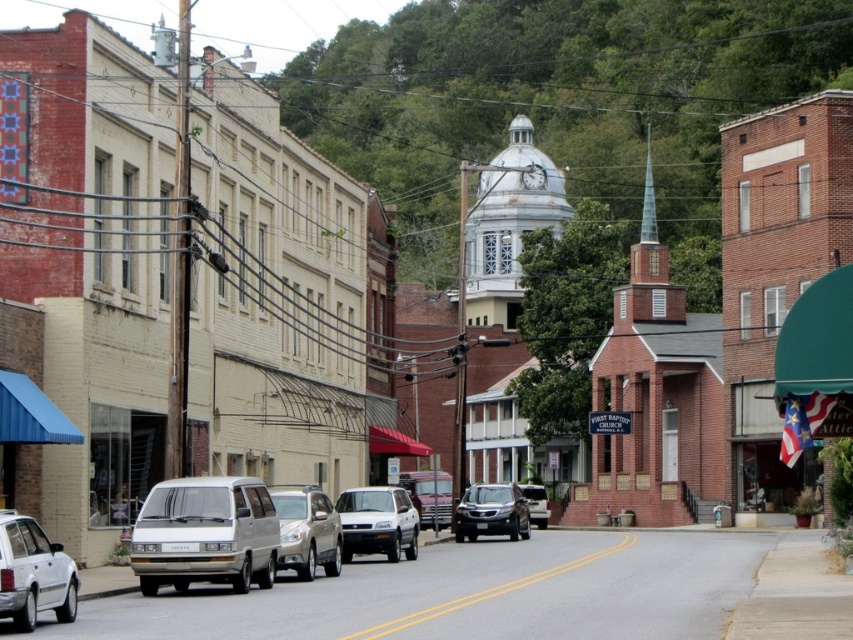
You are standing at the point with coordinates (206, 534) on the street. What object is exactly at your current location?

The white matte van at center is located at point (206, 534), so the object exactly at your current location is the white matte van at center.

You are a delivery driver who needs to park your truck between the white matte van at center and the white matte suv at center on the street. The parking space between them is exactly the size of your truck. Which vehicle should you move closer to so that your truck fits perfectly?

The white matte van at center is bigger than the white matte suv at center. Therefore, you should move closer to the white matte suv at center to fit your truck in the space between them.